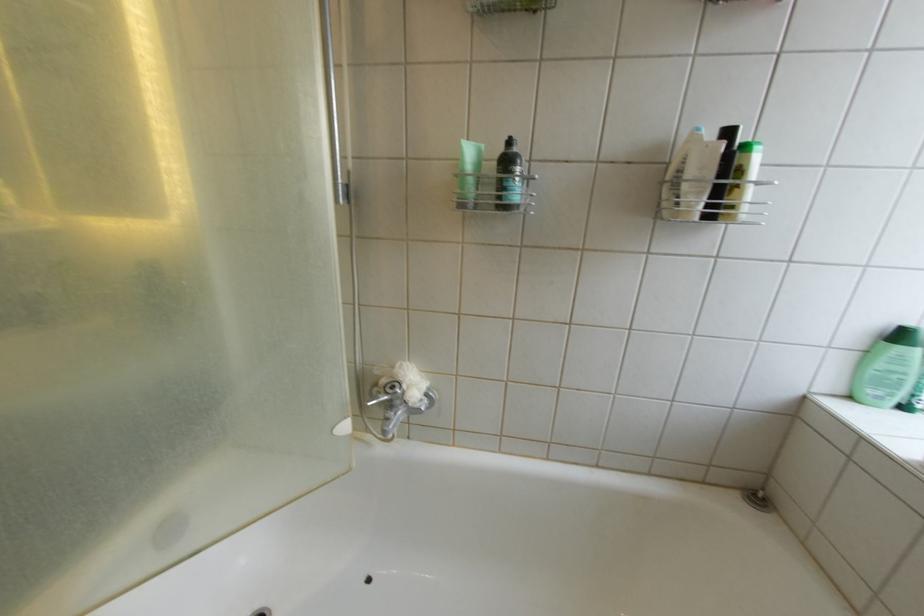
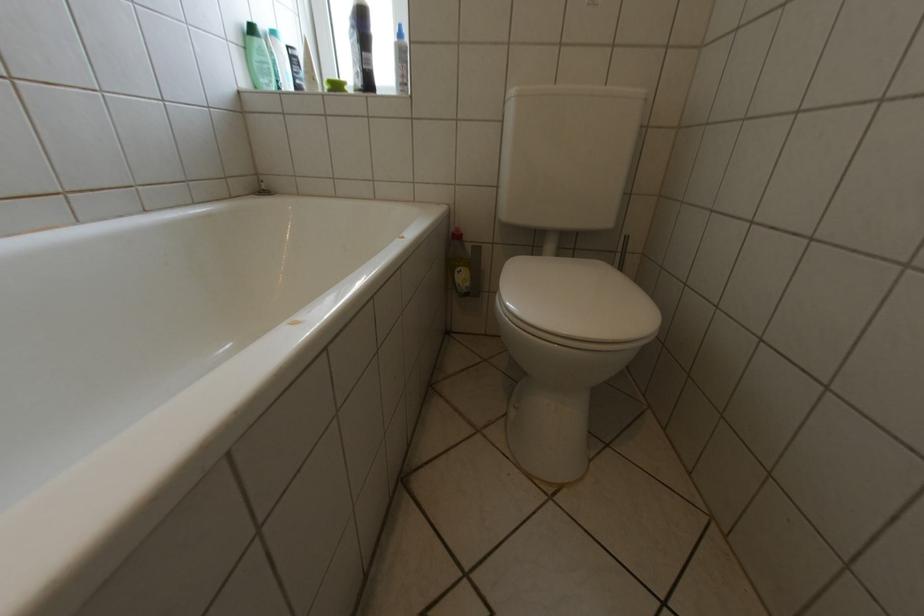
The point at (893,367) is marked in the first image. Where is the corresponding point in the second image?

(268, 59)